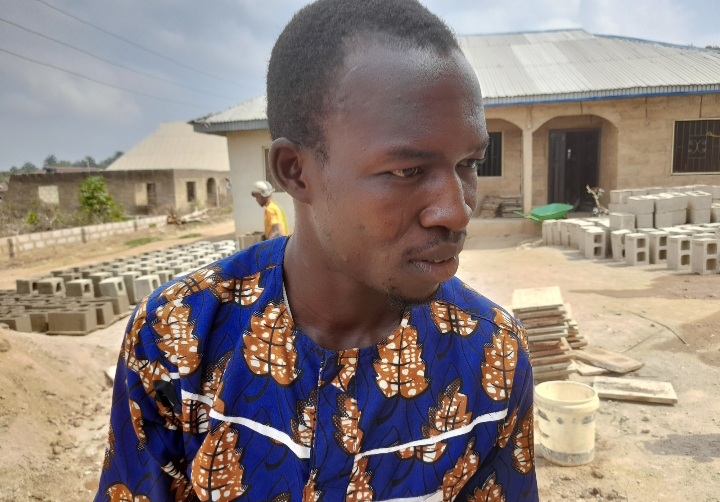
Locate an element on the screen. Image resolution: width=720 pixels, height=502 pixels. arch is located at coordinates (500, 120), (580, 111).